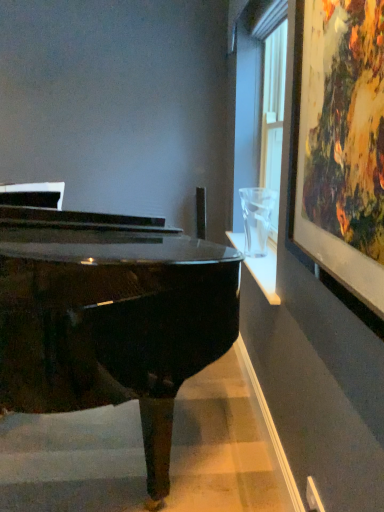
What do you see at coordinates (343, 144) in the screenshot? The width and height of the screenshot is (384, 512). I see `wooden framed artwork at upper right` at bounding box center [343, 144].

Image resolution: width=384 pixels, height=512 pixels. What do you see at coordinates (110, 317) in the screenshot?
I see `glossy black piano at center` at bounding box center [110, 317].

At what (x,y) coordinates should I click in order to perform the action: click on white plastic power outlet at lower right. Please return your answer as a coordinate pair (x, y). The width and height of the screenshot is (384, 512). Looking at the image, I should click on (313, 496).

Is point (128, 269) positioned before point (379, 97)?

No.

Who is bigger, glossy black piano at center or wooden framed artwork at upper right?

glossy black piano at center is bigger.

Locate an element on the screen. Image resolution: width=384 pixels, height=512 pixels. picture frame that appears above the glossy black piano at center (from a real-world perspective) is located at coordinates (343, 144).

Consider the image. Measure the distance from glossy black piano at center to wooden framed artwork at upper right.

glossy black piano at center and wooden framed artwork at upper right are 33.75 inches apart from each other.

From the image's perspective, which object appears higher, white plastic power outlet at lower right or wooden framed artwork at upper right?

wooden framed artwork at upper right.

Is white plastic power outlet at lower right positioned with its back to wooden framed artwork at upper right?

No.

Between white plastic power outlet at lower right and wooden framed artwork at upper right, which one is positioned in front?

wooden framed artwork at upper right is more forward.

Consider the image. Does white plastic power outlet at lower right have a larger size compared to wooden framed artwork at upper right?

No, white plastic power outlet at lower right is not bigger than wooden framed artwork at upper right.

Is white plastic power outlet at lower right at the back of glossy black piano at center?

Yes, white plastic power outlet at lower right is at the back of glossy black piano at center.

Is glossy black piano at center in contact with white plastic power outlet at lower right?

No.

Does glossy black piano at center appear on the right side of white plastic power outlet at lower right?

Incorrect, glossy black piano at center is not on the right side of white plastic power outlet at lower right.

Between glossy black piano at center and white plastic power outlet at lower right, which one has more height?

glossy black piano at center.

Is wooden framed artwork at upper right positioned before white plastic power outlet at lower right?

Yes, wooden framed artwork at upper right is closer to the camera.

Is wooden framed artwork at upper right not inside white plastic power outlet at lower right?

wooden framed artwork at upper right is positioned outside white plastic power outlet at lower right.

Image resolution: width=384 pixels, height=512 pixels. I want to click on power outlet on the right side of wooden framed artwork at upper right, so click(x=313, y=496).

Considering the points (377, 195) and (307, 499), which point is behind, point (377, 195) or point (307, 499)?

The point (307, 499) is farther from the camera.

Is white plastic power outlet at lower right situated inside glossy black piano at center or outside?

white plastic power outlet at lower right is not inside glossy black piano at center, it's outside.

Does white plastic power outlet at lower right have a smaller size compared to glossy black piano at center?

Yes.

Which of these two, white plastic power outlet at lower right or glossy black piano at center, stands shorter?

With less height is white plastic power outlet at lower right.

Is white plastic power outlet at lower right far from glossy black piano at center?

Yes.

Considering the relative sizes of wooden framed artwork at upper right and glossy black piano at center in the image provided, is wooden framed artwork at upper right bigger than glossy black piano at center?

Actually, wooden framed artwork at upper right might be smaller than glossy black piano at center.

From the image's perspective, which is below, wooden framed artwork at upper right or glossy black piano at center?

glossy black piano at center, from the image's perspective.

Is wooden framed artwork at upper right aimed at glossy black piano at center?

No, wooden framed artwork at upper right is not facing towards glossy black piano at center.

Locate an element on the screen. piano below the wooden framed artwork at upper right (from the image's perspective) is located at coordinates (x=110, y=317).

Where is `piano directly beneath the wooden framed artwork at upper right (from a real-world perspective)`? piano directly beneath the wooden framed artwork at upper right (from a real-world perspective) is located at coordinates (110, 317).

Locate an element on the screen. The width and height of the screenshot is (384, 512). power outlet behind the wooden framed artwork at upper right is located at coordinates (313, 496).

Which object lies nearer to the anchor point glossy black piano at center, wooden framed artwork at upper right or white plastic power outlet at lower right?

Among the two, wooden framed artwork at upper right is located nearer to glossy black piano at center.

Considering their positions, is glossy black piano at center positioned closer to wooden framed artwork at upper right than white plastic power outlet at lower right?

glossy black piano at center.

Looking at the image, which one is located further to white plastic power outlet at lower right, glossy black piano at center or wooden framed artwork at upper right?

wooden framed artwork at upper right.

Which object lies nearer to the anchor point glossy black piano at center, white plastic power outlet at lower right or wooden framed artwork at upper right?

The object closer to glossy black piano at center is wooden framed artwork at upper right.

From the picture: Looking at the image, which one is located further to white plastic power outlet at lower right, wooden framed artwork at upper right or glossy black piano at center?

wooden framed artwork at upper right.

Considering their positions, is white plastic power outlet at lower right positioned further to wooden framed artwork at upper right than glossy black piano at center?

The object further to wooden framed artwork at upper right is white plastic power outlet at lower right.

Find the location of a particular element. The height and width of the screenshot is (512, 384). piano between wooden framed artwork at upper right and white plastic power outlet at lower right in the up-down direction is located at coordinates (110, 317).